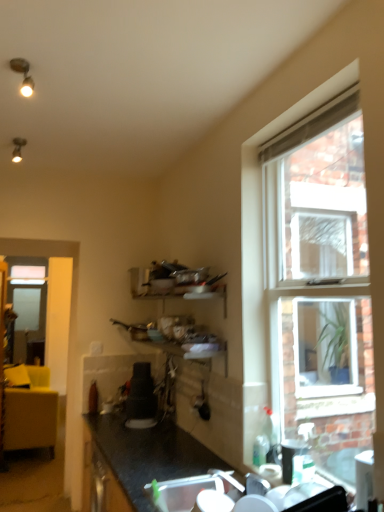
Find the location of a particular element. The height and width of the screenshot is (512, 384). transparent glass screen door at left is located at coordinates (27, 317).

Can satin black coffee maker at center, marked as the 1th appliance in a left-to-right arrangement, be found inside transparent glass screen door at left?

No, satin black coffee maker at center, marked as the 1th appliance in a left-to-right arrangement, is not a part of transparent glass screen door at left.

In the scene shown: Does transparent glass screen door at left have a smaller size compared to satin black coffee maker at center, the 2th appliance when ordered from right to left?

Incorrect, transparent glass screen door at left is not smaller in size than satin black coffee maker at center, the 2th appliance when ordered from right to left.

From the picture: Which point is more distant from viewer, (45, 288) or (134, 394)?

The point (45, 288) is farther.

Does white plastic sink at lower center turn towards satin black coffee maker at center, the 2th appliance when ordered from right to left?

No, white plastic sink at lower center is not facing towards satin black coffee maker at center, the 2th appliance when ordered from right to left.

Considering the points (193, 487) and (136, 408), which point is in front, point (193, 487) or point (136, 408)?

Point (193, 487)

From the image's perspective, is white plastic sink at lower center located beneath satin black coffee maker at center, which appears as the second appliance when viewed from the front?

Yes, from the image's perspective, white plastic sink at lower center is below satin black coffee maker at center, which appears as the second appliance when viewed from the front.

Considering the positions of objects white plastic sink at lower center and satin black coffee maker at center, the 2th appliance when ordered from right to left, in the image provided, who is more to the right, white plastic sink at lower center or satin black coffee maker at center, the 2th appliance when ordered from right to left,?

Positioned to the right is white plastic sink at lower center.

Considering the relative positions of satin black coffee maker at center, the 2th appliance when ordered from right to left, and transparent glass screen door at left in the image provided, is satin black coffee maker at center, the 2th appliance when ordered from right to left, to the right of transparent glass screen door at left from the viewer's perspective?

Correct, you'll find satin black coffee maker at center, the 2th appliance when ordered from right to left, to the right of transparent glass screen door at left.

From the image's perspective, is satin black coffee maker at center, the 2th appliance when ordered from right to left, above transparent glass screen door at left?

Yes.

Could you tell me if satin black coffee maker at center, the 1th appliance in the back-to-front sequence, is turned towards transparent glass screen door at left?

No, satin black coffee maker at center, the 1th appliance in the back-to-front sequence, is not oriented towards transparent glass screen door at left.

Does satin black coffee maker at center, which appears as the second appliance when viewed from the front, lie in front of transparent glass screen door at left?

Yes, it is in front of transparent glass screen door at left.

Is black plastic cup at lower right, the first appliance in the right-to-left sequence, to the left or to the right of satin black coffee maker at center, which appears as the second appliance when viewed from the front, in the image?

In the image, black plastic cup at lower right, the first appliance in the right-to-left sequence, appears on the right side of satin black coffee maker at center, which appears as the second appliance when viewed from the front.

Who is more distant, black plastic cup at lower right, which is the second appliance from left to right, or satin black coffee maker at center, which appears as the second appliance when viewed from the front?

satin black coffee maker at center, which appears as the second appliance when viewed from the front, is further away from the camera.

Locate an element on the screen. Image resolution: width=384 pixels, height=512 pixels. appliance located underneath the satin black coffee maker at center, marked as the 1th appliance in a left-to-right arrangement (from a real-world perspective) is located at coordinates (291, 456).

From the image's perspective, is black plastic cup at lower right, the first appliance in the front-to-back sequence, located above satin black coffee maker at center, which appears as the second appliance when viewed from the front?

Yes, from the image's perspective, black plastic cup at lower right, the first appliance in the front-to-back sequence, is over satin black coffee maker at center, which appears as the second appliance when viewed from the front.

What's the angular difference between transparent glass screen door at left and clear glass window at right's facing directions?

The angular difference between transparent glass screen door at left and clear glass window at right is 88.2 degrees.

In the image, is transparent glass screen door at left positioned in front of or behind clear glass window at right?

In the image, transparent glass screen door at left appears behind clear glass window at right.

Find the location of a particular element. This screenshot has width=384, height=512. window to the right of transparent glass screen door at left is located at coordinates (262, 248).

Which object is thinner, transparent glass screen door at left or clear glass window at right?

With smaller width is transparent glass screen door at left.

How much distance is there between satin black coffee maker at center, the 1th appliance in the back-to-front sequence, and clear glass window at right?

The distance of satin black coffee maker at center, the 1th appliance in the back-to-front sequence, from clear glass window at right is 1.15 meters.

Considering the relative sizes of satin black coffee maker at center, the 2th appliance when ordered from right to left, and clear glass window at right in the image provided, is satin black coffee maker at center, the 2th appliance when ordered from right to left, shorter than clear glass window at right?

Yes.

Is satin black coffee maker at center, the 1th appliance in the back-to-front sequence, positioned beyond the bounds of clear glass window at right?

That's correct, satin black coffee maker at center, the 1th appliance in the back-to-front sequence, is outside of clear glass window at right.

Considering their positions, is satin black coffee maker at center, which appears as the second appliance when viewed from the front, located in front of or behind clear glass window at right?

satin black coffee maker at center, which appears as the second appliance when viewed from the front, is positioned farther from the viewer than clear glass window at right.

Are clear glass window at right and white plastic sink at lower center beside each other?

clear glass window at right and white plastic sink at lower center are clearly separated.

Between clear glass window at right and white plastic sink at lower center, which one has less height?

Standing shorter between the two is white plastic sink at lower center.

Is clear glass window at right completely or partially outside of white plastic sink at lower center?

clear glass window at right lies outside white plastic sink at lower center's area.

Where is `the 1st appliance directly beneath the transparent glass screen door at left (from a real-world perspective)`? Image resolution: width=384 pixels, height=512 pixels. the 1st appliance directly beneath the transparent glass screen door at left (from a real-world perspective) is located at coordinates (141, 398).

Locate an element on the screen. The height and width of the screenshot is (512, 384). appliance that is the 2nd object above the white plastic sink at lower center (from a real-world perspective) is located at coordinates (141, 398).

Which object lies further to the anchor point satin black coffee maker at center, the 1th appliance in the back-to-front sequence, black plastic cup at lower right, the first appliance in the front-to-back sequence, or clear glass window at right?

black plastic cup at lower right, the first appliance in the front-to-back sequence, is further to satin black coffee maker at center, the 1th appliance in the back-to-front sequence.

Looking at the image, which one is located closer to black plastic cup at lower right, which is the second appliance from left to right, clear glass window at right or satin black coffee maker at center, the 2th appliance when ordered from right to left?

clear glass window at right.

Considering their positions, is transparent glass screen door at left positioned closer to black plastic cup at lower right, the first appliance in the front-to-back sequence, than clear glass window at right?

clear glass window at right is closer to black plastic cup at lower right, the first appliance in the front-to-back sequence.

When comparing their distances from black plastic cup at lower right, which is the second appliance from left to right, does satin black coffee maker at center, the 1th appliance in the back-to-front sequence, or clear glass window at right seem closer?

clear glass window at right lies closer to black plastic cup at lower right, which is the second appliance from left to right, than the other object.

Looking at this image, which object lies nearer to the anchor point clear glass window at right, white plastic sink at lower center or transparent glass screen door at left?

white plastic sink at lower center is closer to clear glass window at right.

When comparing their distances from black plastic cup at lower right, which is the second appliance from left to right, does transparent glass screen door at left or white plastic sink at lower center seem further?

Based on the image, transparent glass screen door at left appears to be further to black plastic cup at lower right, which is the second appliance from left to right.

Considering their positions, is satin black coffee maker at center, which appears as the second appliance when viewed from the front, positioned closer to clear glass window at right than white plastic sink at lower center?

white plastic sink at lower center is positioned closer to the anchor clear glass window at right.

Based on their spatial positions, is satin black coffee maker at center, the 1th appliance in the back-to-front sequence, or clear glass window at right further from white plastic sink at lower center?

satin black coffee maker at center, the 1th appliance in the back-to-front sequence, is positioned further to the anchor white plastic sink at lower center.

Locate an element on the screen. This screenshot has height=512, width=384. sink positioned between clear glass window at right and satin black coffee maker at center, the 1th appliance in the back-to-front sequence, from near to far is located at coordinates (193, 490).

This screenshot has height=512, width=384. I want to click on appliance between white plastic sink at lower center and satin black coffee maker at center, the 2th appliance when ordered from right to left, in the front-back direction, so click(x=291, y=456).

Where is `appliance between black plastic cup at lower right, which is the second appliance from left to right, and transparent glass screen door at left in the front-back direction`? Image resolution: width=384 pixels, height=512 pixels. appliance between black plastic cup at lower right, which is the second appliance from left to right, and transparent glass screen door at left in the front-back direction is located at coordinates (141, 398).

I want to click on sink between clear glass window at right and transparent glass screen door at left in the front-back direction, so click(x=193, y=490).